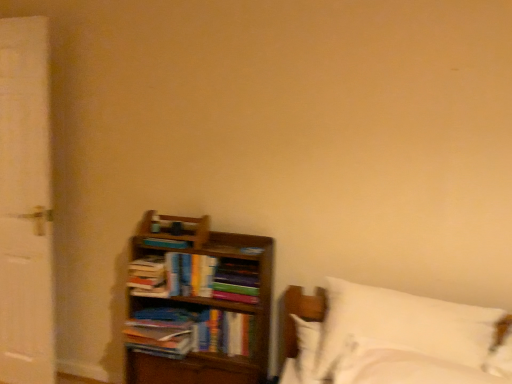
Question: From a real-world perspective, is white soft bed at lower right located higher than hardcover books at left, which appears as the 2th book when viewed from the top?

Choices:
 (A) no
 (B) yes

Answer: (A)

Question: Could you tell me if white soft bed at lower right is facing hardcover books at left, which appears as the 2th book when viewed from the top?

Choices:
 (A) no
 (B) yes

Answer: (A)

Question: Does white soft bed at lower right have a greater width compared to hardcover books at left, which appears as the 3th book when ordered from the bottom?

Choices:
 (A) yes
 (B) no

Answer: (A)

Question: Is the depth of white soft bed at lower right less than that of hardcover books at left, which appears as the 2th book when viewed from the top?

Choices:
 (A) yes
 (B) no

Answer: (A)

Question: Considering the relative sizes of white soft bed at lower right and hardcover books at left, which appears as the 3th book when ordered from the bottom, in the image provided, is white soft bed at lower right shorter than hardcover books at left, which appears as the 3th book when ordered from the bottom,?

Choices:
 (A) no
 (B) yes

Answer: (A)

Question: Is white soft bed at lower right looking in the opposite direction of hardcover books at left, which appears as the 3th book when ordered from the bottom?

Choices:
 (A) yes
 (B) no

Answer: (B)

Question: Considering the relative positions of wooden bookcase at lower left and white painted wood screen door at left in the image provided, is wooden bookcase at lower left to the right of white painted wood screen door at left from the viewer's perspective?

Choices:
 (A) no
 (B) yes

Answer: (B)

Question: Considering the relative sizes of wooden bookcase at lower left and white painted wood screen door at left in the image provided, is wooden bookcase at lower left wider than white painted wood screen door at left?

Choices:
 (A) no
 (B) yes

Answer: (B)

Question: From the image's perspective, is wooden bookcase at lower left under white painted wood screen door at left?

Choices:
 (A) no
 (B) yes

Answer: (B)

Question: Is wooden bookcase at lower left not within white painted wood screen door at left?

Choices:
 (A) yes
 (B) no

Answer: (A)

Question: Is wooden bookcase at lower left not close to white painted wood screen door at left?

Choices:
 (A) yes
 (B) no

Answer: (B)

Question: Does wooden bookcase at lower left touch white painted wood screen door at left?

Choices:
 (A) yes
 (B) no

Answer: (B)

Question: From the image's perspective, is hardcover book at center, the fourth book positioned from the top, located above hardcover books at center, the second book when ordered from bottom to top?

Choices:
 (A) yes
 (B) no

Answer: (B)